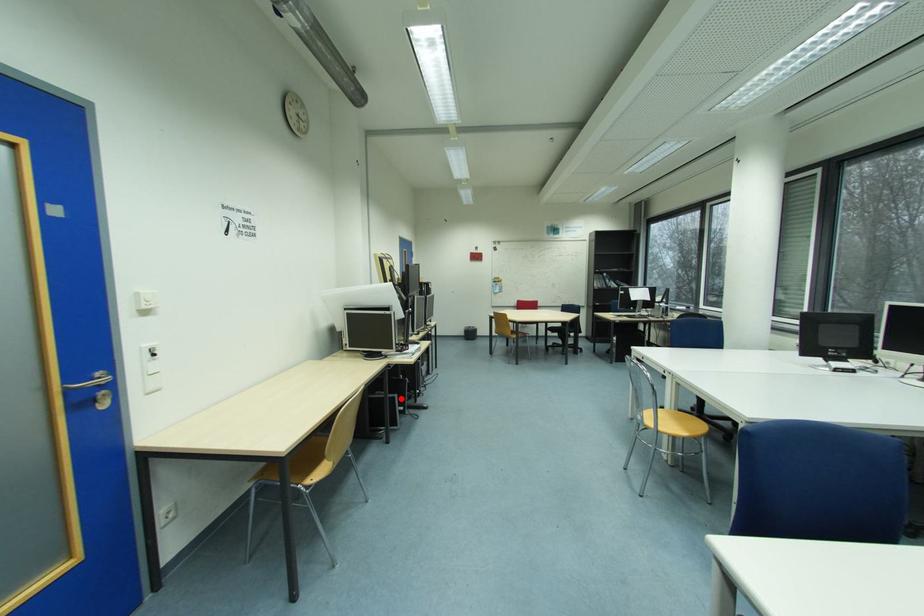
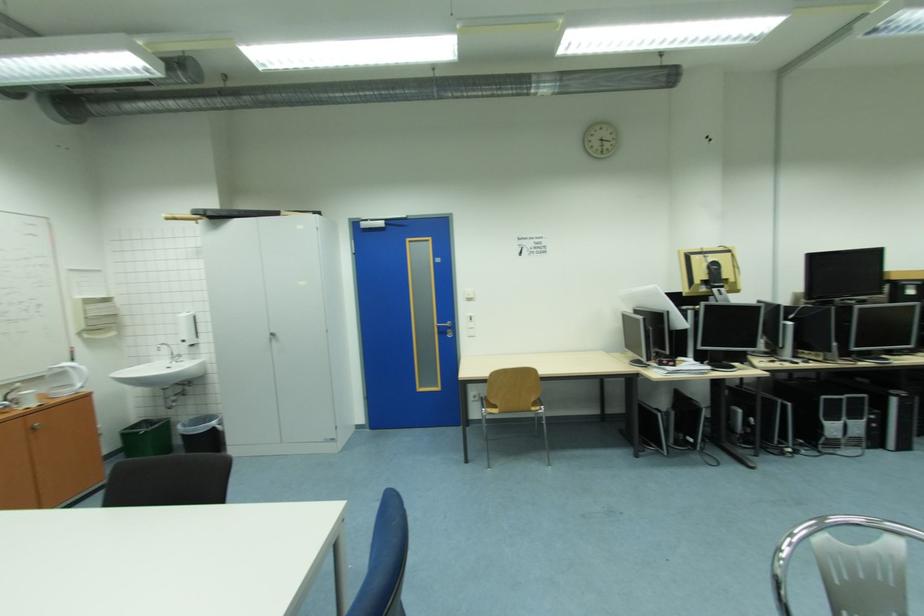
Question: I am providing you with two images of the same scene from different viewpoints. A red point is shown in image1. For the corresponding object point in image2, is it positioned nearer or farther from the camera?

Choices:
 (A) Nearer
 (B) Farther

Answer: (B)